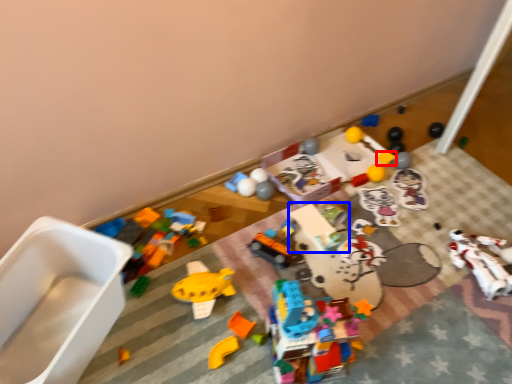
Question: Which object is closer to the camera taking this photo, toy (highlighted by a red box) or toy (highlighted by a blue box)?

Choices:
 (A) toy
 (B) toy

Answer: (B)